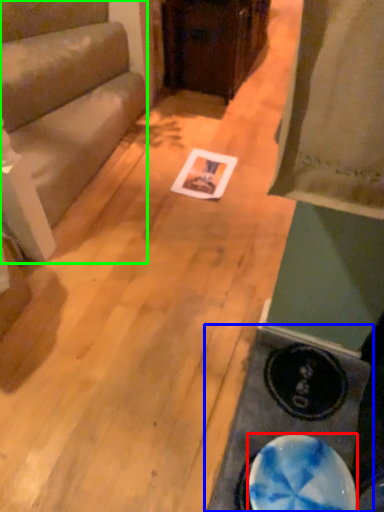
Question: Estimate the real-world distances between objects in this image. Which object is closer to plate (highlighted by a red box), table (highlighted by a blue box) or furniture (highlighted by a green box)?

Choices:
 (A) table
 (B) furniture

Answer: (A)